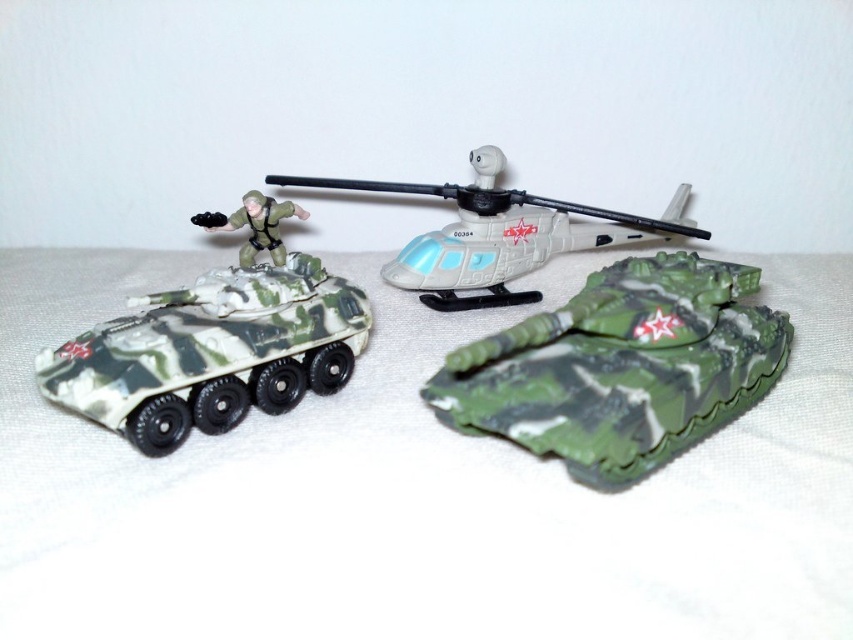
Question: Can you confirm if camouflage plastic tank at center is positioned to the left of matte green figure at center?

Choices:
 (A) no
 (B) yes

Answer: (A)

Question: Observing the image, what is the correct spatial positioning of camouflage plastic tank at center in reference to matte green figure at center?

Choices:
 (A) left
 (B) right

Answer: (B)

Question: Which point is farther from the camera taking this photo?

Choices:
 (A) (463, 365)
 (B) (286, 214)
 (C) (264, 179)

Answer: (C)

Question: Estimate the real-world distances between objects in this image. Which object is farther from the camouflage plastic tank at center?

Choices:
 (A) matte green figure at center
 (B) camo plastic tank at left
 (C) matte plastic helicopter at center

Answer: (A)

Question: Is camouflage plastic tank at center positioned in front of matte plastic helicopter at center?

Choices:
 (A) yes
 (B) no

Answer: (A)

Question: Based on their relative distances, which object is nearer to the matte plastic helicopter at center?

Choices:
 (A) camouflage plastic tank at center
 (B) matte green figure at center
 (C) camo plastic tank at left

Answer: (B)